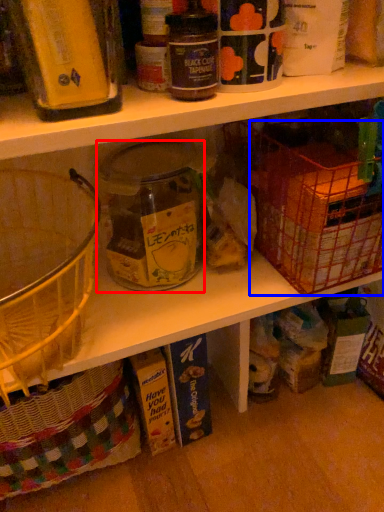
Question: Among these objects, which one is farthest to the camera, glass jar (highlighted by a red box) or basket (highlighted by a blue box)?

Choices:
 (A) glass jar
 (B) basket

Answer: (A)